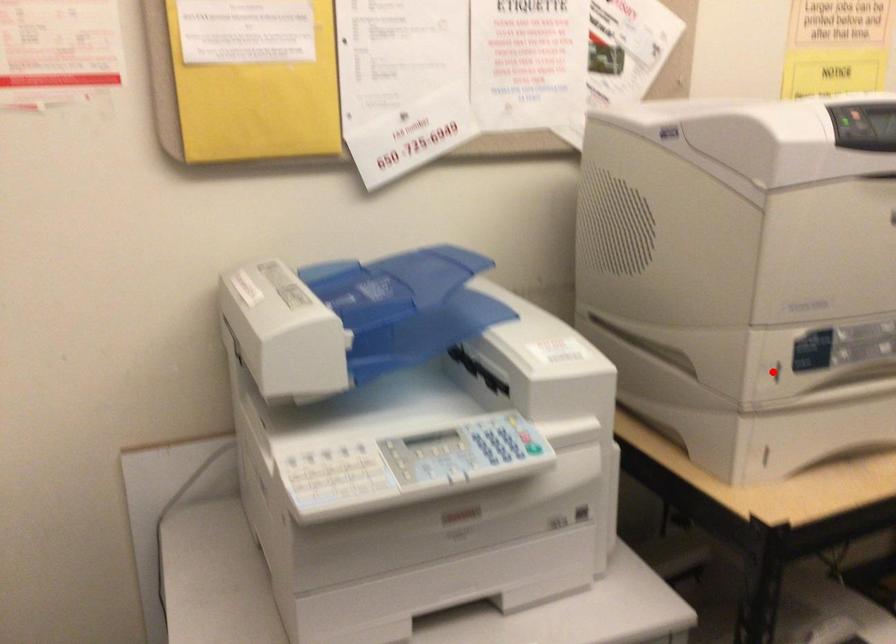
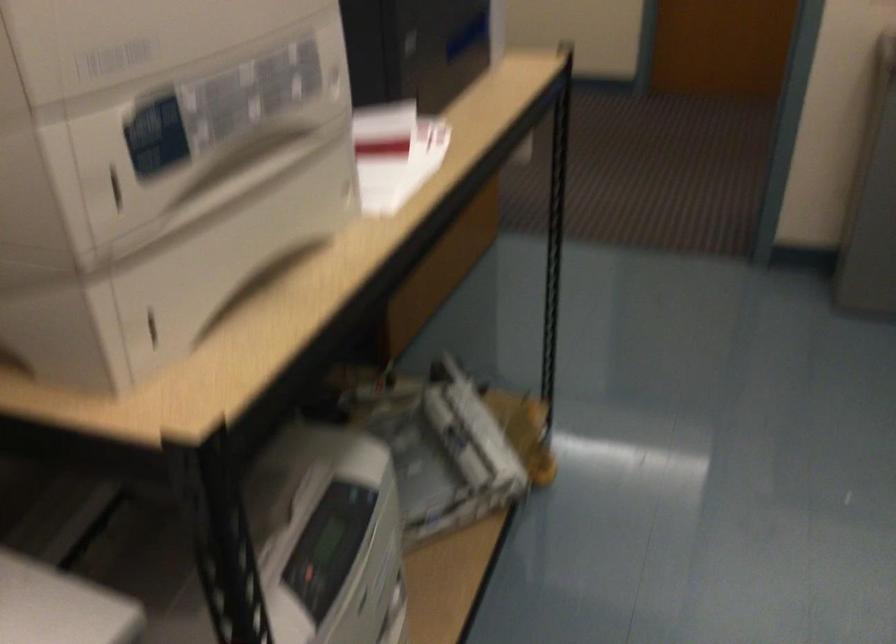
Question: A red point is marked in image1. In image2, is the corresponding 3D point closer to the camera or farther? Reply with the corresponding letter.

Choices:
 (A) The corresponding 3D point is closer.
 (B) The corresponding 3D point is farther.

Answer: (A)